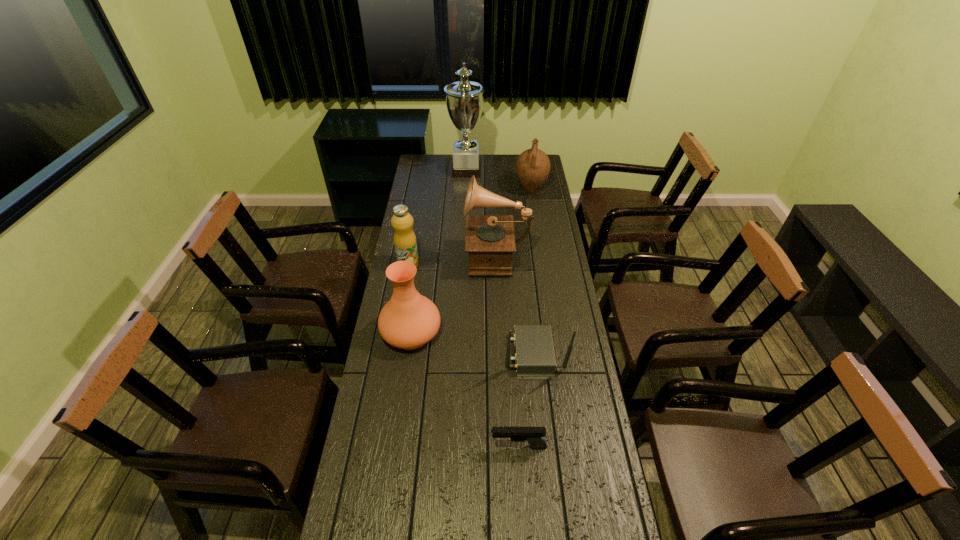
Locate an element on the screen. The image size is (960, 540). vacant space situated 0.260m on the horn of the record player is located at coordinates (407, 254).

Find the location of a particular element. This screenshot has height=540, width=960. vacant space situated 0.200m on the horn of the record player is located at coordinates (420, 254).

The width and height of the screenshot is (960, 540). I want to click on vacant space located 0.100m on the front of the vase, so click(404, 382).

Locate an element on the screen. This screenshot has height=540, width=960. vacant space situated on the front label of the fruit juice is located at coordinates (498, 265).

Where is `vacant space located 0.180m on the back of the pitcher`? The width and height of the screenshot is (960, 540). vacant space located 0.180m on the back of the pitcher is located at coordinates (527, 164).

Identify the location of vacant region located 0.230m on the back of the router to connect cables. (439, 353).

Find the location of a particular element. The height and width of the screenshot is (540, 960). vacant region located on the back of the router to connect cables is located at coordinates (450, 353).

Locate an element on the screen. free region located on the back of the router to connect cables is located at coordinates (490, 353).

The width and height of the screenshot is (960, 540). Find the location of `free location located 0.210m on the front-facing side of the shortest object`. free location located 0.210m on the front-facing side of the shortest object is located at coordinates (420, 447).

Find the location of a particular element. This screenshot has height=540, width=960. vacant space situated 0.150m on the front-facing side of the shortest object is located at coordinates (441, 447).